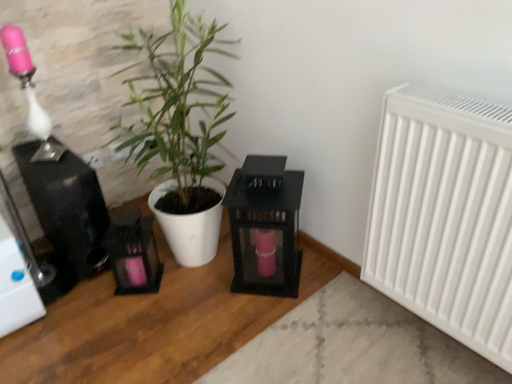
Question: Is the position of white matte radiator at right more distant than that of black glass lantern at center?

Choices:
 (A) yes
 (B) no

Answer: (B)

Question: Considering the relative sizes of white matte radiator at right and black glass lantern at center in the image provided, is white matte radiator at right bigger than black glass lantern at center?

Choices:
 (A) yes
 (B) no

Answer: (A)

Question: Can black glass lantern at center be found inside white matte radiator at right?

Choices:
 (A) yes
 (B) no

Answer: (B)

Question: Is white matte radiator at right beside black glass lantern at center?

Choices:
 (A) yes
 (B) no

Answer: (B)

Question: Is white matte radiator at right not close to black glass lantern at center?

Choices:
 (A) yes
 (B) no

Answer: (B)

Question: Is white matte radiator at right not inside black glass lantern at center?

Choices:
 (A) yes
 (B) no

Answer: (A)

Question: Is white matte plant pot at center surrounded by matte pink glass at upper left?

Choices:
 (A) yes
 (B) no

Answer: (B)

Question: Is matte pink glass at upper left touching white matte plant pot at center?

Choices:
 (A) no
 (B) yes

Answer: (A)

Question: Is matte pink glass at upper left further to the viewer compared to white matte plant pot at center?

Choices:
 (A) yes
 (B) no

Answer: (A)

Question: Is matte pink glass at upper left at the right side of white matte plant pot at center?

Choices:
 (A) no
 (B) yes

Answer: (A)

Question: From the image's perspective, is matte pink glass at upper left located beneath white matte plant pot at center?

Choices:
 (A) no
 (B) yes

Answer: (A)

Question: Is matte pink glass at upper left facing towards white matte plant pot at center?

Choices:
 (A) no
 (B) yes

Answer: (A)

Question: Considering the relative sizes of black glass lantern at center and white matte plant pot at center in the image provided, is black glass lantern at center smaller than white matte plant pot at center?

Choices:
 (A) no
 (B) yes

Answer: (B)